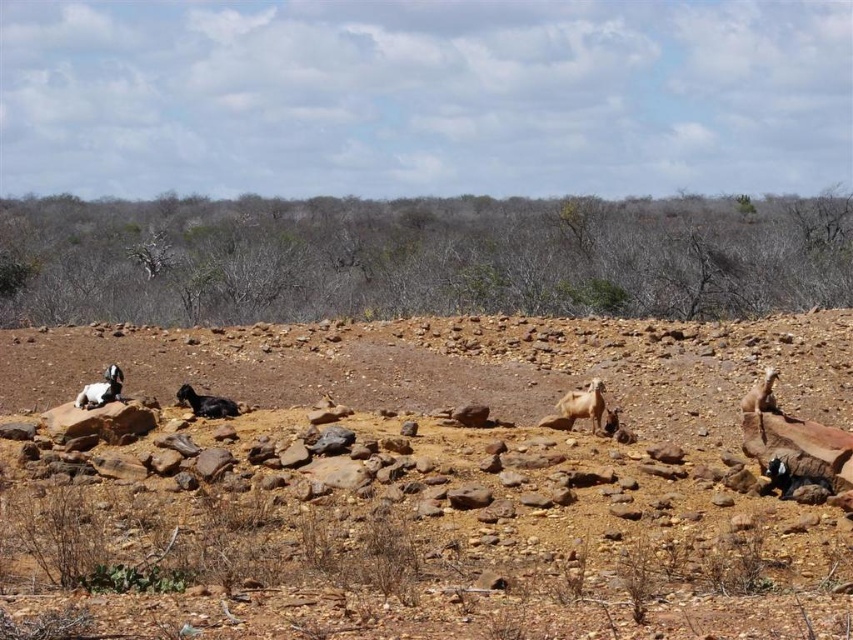
Based on the photo, you are a hiker carrying a 3 meter long tent pole. You want to set up camp on the brown rocky dirt field at center. Can you safely place the tent pole horizontally on the ground there without it extending beyond the field?

The brown rocky dirt field at center is 5.25 meters away from you. However, the description does not provide the size of the field itself. Without knowing the field size, it is impossible to determine if the 3 meter tent pole would fit. More information is needed about the field dimensions.

You are a hiker who wants to place a marker at the point labeled as point (424, 483). According to the scene description, where exactly should you place the marker?

The point (424, 483) should be placed on the brown rocky dirt field at center as described in the scene.